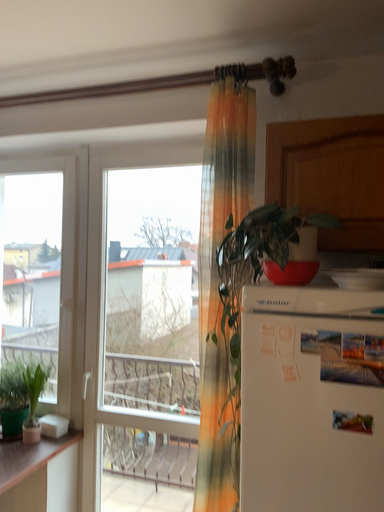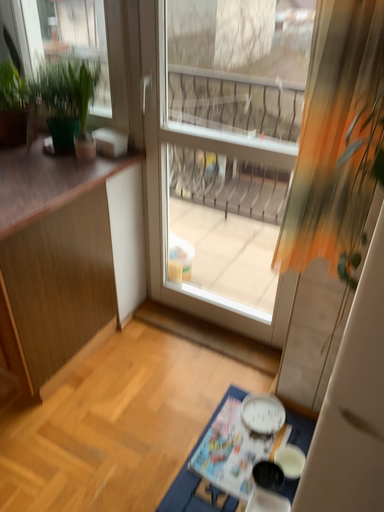
Question: How did the camera likely rotate when shooting the video?

Choices:
 (A) rotated upward
 (B) rotated downward

Answer: (B)